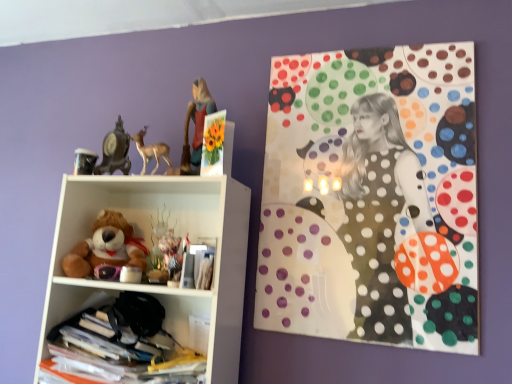
Question: From a real-world perspective, is matte plastic figurine of girl at upper center on top of polka dot fabric at upper right?

Choices:
 (A) yes
 (B) no

Answer: (A)

Question: Is matte plastic figurine of girl at upper center positioned in front of polka dot fabric at upper right?

Choices:
 (A) yes
 (B) no

Answer: (B)

Question: From a real-world perspective, is matte plastic figurine of girl at upper center below polka dot fabric at upper right?

Choices:
 (A) yes
 (B) no

Answer: (B)

Question: Considering the relative sizes of matte plastic figurine of girl at upper center and polka dot fabric at upper right in the image provided, is matte plastic figurine of girl at upper center wider than polka dot fabric at upper right?

Choices:
 (A) yes
 (B) no

Answer: (A)

Question: Is matte plastic figurine of girl at upper center aimed at polka dot fabric at upper right?

Choices:
 (A) yes
 (B) no

Answer: (B)

Question: Considering the relative positions of matte plastic figurine of girl at upper center and polka dot fabric at upper right in the image provided, is matte plastic figurine of girl at upper center behind polka dot fabric at upper right?

Choices:
 (A) no
 (B) yes

Answer: (B)

Question: Would you say polka dot fabric at upper right contains matte black cup at upper left, which ranks as the 2th toy in bottom-to-top order?

Choices:
 (A) yes
 (B) no

Answer: (B)

Question: Can you confirm if polka dot fabric at upper right is smaller than matte black cup at upper left, the 2th toy viewed from the top?

Choices:
 (A) no
 (B) yes

Answer: (A)

Question: Is polka dot fabric at upper right outside matte black cup at upper left, which ranks as the 2th toy in bottom-to-top order?

Choices:
 (A) yes
 (B) no

Answer: (A)

Question: Does polka dot fabric at upper right come behind matte black cup at upper left, the 2th toy viewed from the top?

Choices:
 (A) no
 (B) yes

Answer: (A)

Question: Is polka dot fabric at upper right taller than matte black cup at upper left, placed as the 1th toy when sorted from left to right?

Choices:
 (A) yes
 (B) no

Answer: (A)

Question: Is polka dot fabric at upper right far away from matte black cup at upper left, placed as the third toy when sorted from right to left?

Choices:
 (A) yes
 (B) no

Answer: (B)

Question: Does matte black clock at upper left, the second toy when ordered from right to left, appear on the right side of matte black cup at upper left, placed as the 1th toy when sorted from left to right?

Choices:
 (A) no
 (B) yes

Answer: (B)